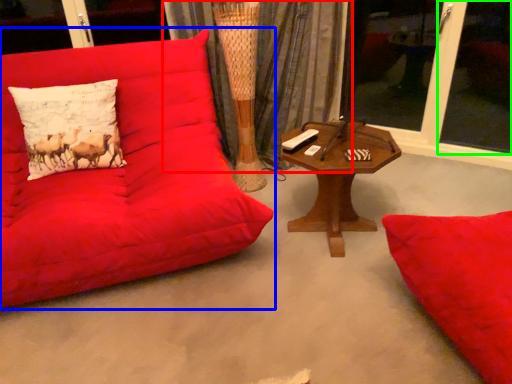
Question: Which object is the closest to the curtain (highlighted by a red box)? Choose among these: studio couch (highlighted by a blue box) or window screen (highlighted by a green box).

Choices:
 (A) studio couch
 (B) window screen

Answer: (A)